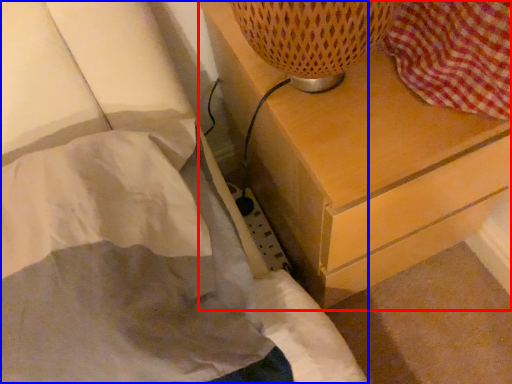
Question: Which point is closer to the camera, chest of drawers (highlighted by a red box) or bed (highlighted by a blue box)?

Choices:
 (A) chest of drawers
 (B) bed

Answer: (B)